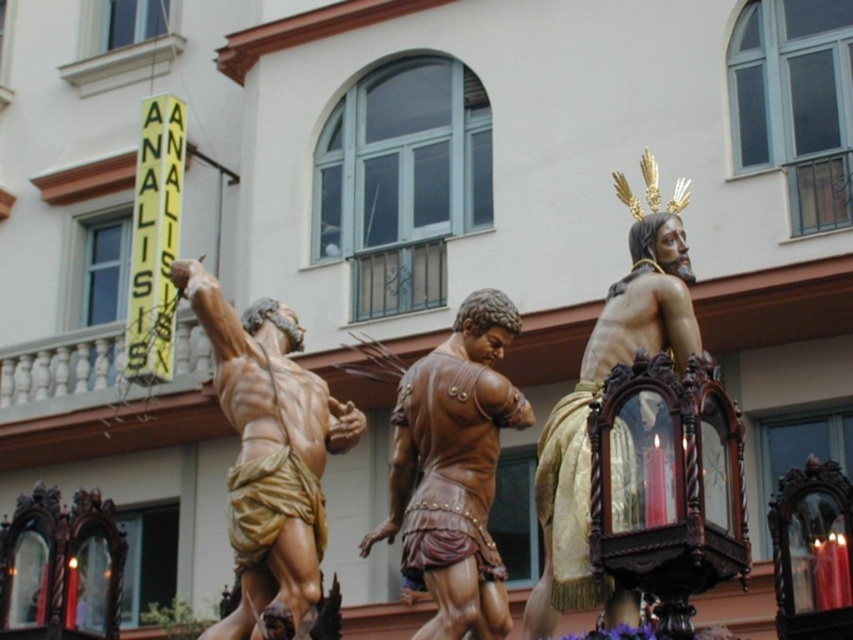
Question: Among these objects, which one is nearest to the camera?

Choices:
 (A) brown polished wood statue at center
 (B) gold polished statue at center
 (C) matte gold statue at center

Answer: (B)

Question: Which point appears farthest from the camera in this image?

Choices:
 (A) (489, 572)
 (B) (554, 522)

Answer: (A)

Question: Can you confirm if matte gold statue at center is thinner than gold polished statue at center?

Choices:
 (A) no
 (B) yes

Answer: (B)

Question: Which of the following is the farthest from the observer?

Choices:
 (A) (404, 406)
 (B) (294, 428)
 (C) (587, 358)

Answer: (A)

Question: Does matte gold statue at center appear on the right side of brown polished wood statue at center?

Choices:
 (A) no
 (B) yes

Answer: (A)

Question: Is matte gold statue at center thinner than gold polished statue at center?

Choices:
 (A) yes
 (B) no

Answer: (A)